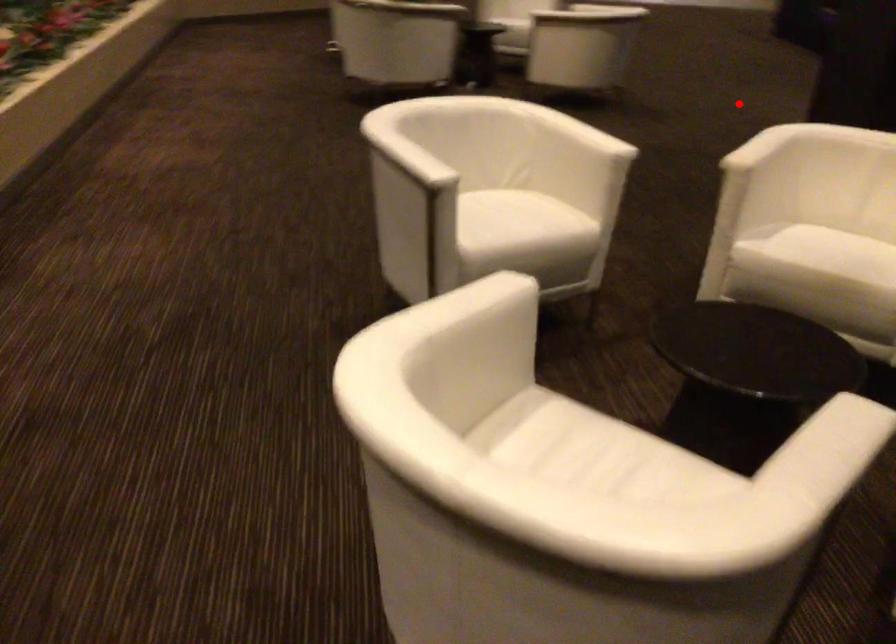
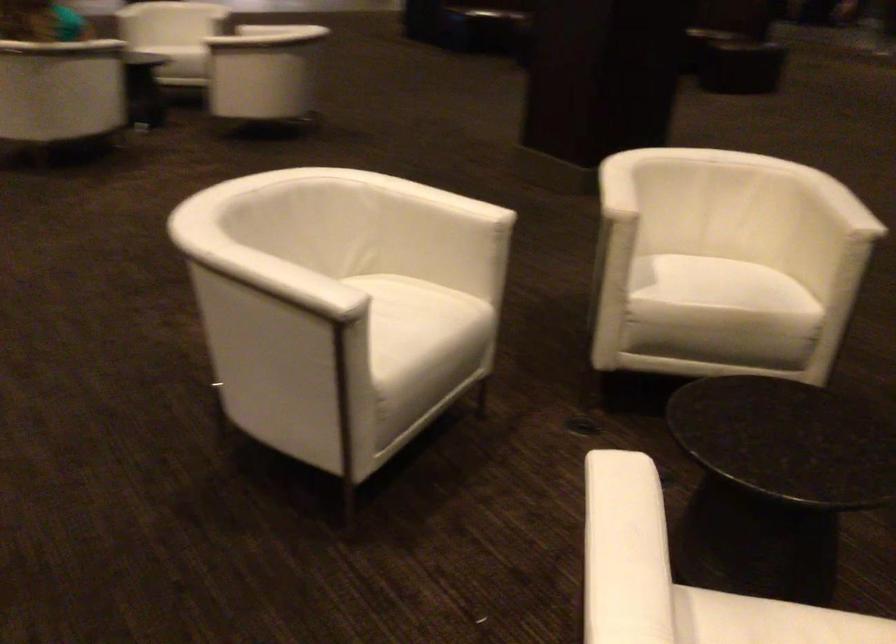
Question: I am providing you with two images of the same scene from different viewpoints. A red point is marked on the first image. Is the red point's position out of view in image 2?

Choices:
 (A) Yes
 (B) No

Answer: (A)